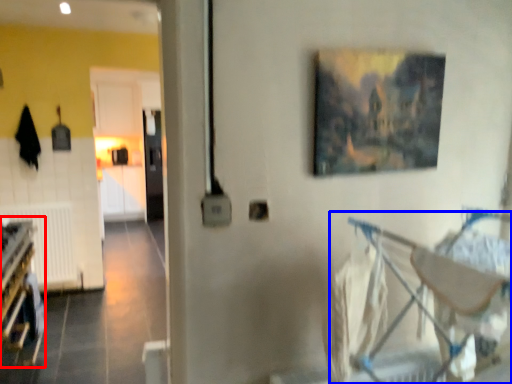
Question: Which object is further to the camera taking this photo, bunk bed (highlighted by a red box) or baby carriage (highlighted by a blue box)?

Choices:
 (A) bunk bed
 (B) baby carriage

Answer: (A)